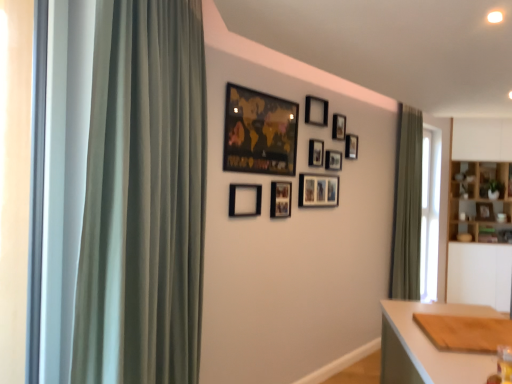
Question: Can you confirm if matte black picture frame at upper center, the second picture frame from the left, is positioned to the right of black matte picture frame at upper center, the 2th picture frame in the right-to-left sequence?

Choices:
 (A) no
 (B) yes

Answer: (A)

Question: Is black matte picture frame at upper center, which is counted as the second picture frame, starting from the back, a part of matte black picture frame at upper center, which is the first picture frame from front to back?

Choices:
 (A) no
 (B) yes

Answer: (A)

Question: From a real-world perspective, is matte black picture frame at upper center, which appears as the tenth picture frame when viewed from the back, physically below black matte picture frame at upper center, which is counted as the second picture frame, starting from the back?

Choices:
 (A) no
 (B) yes

Answer: (B)

Question: Is matte black picture frame at upper center, which is the first picture frame from front to back, closer to the viewer compared to black matte picture frame at upper center, arranged as the ninth picture frame when viewed from the front?

Choices:
 (A) yes
 (B) no

Answer: (A)

Question: Is matte black picture frame at upper center, placed as the 9th picture frame when sorted from right to left, with black matte picture frame at upper center, which is counted as the second picture frame, starting from the back?

Choices:
 (A) yes
 (B) no

Answer: (B)

Question: From the image's perspective, is black matte picture frame at upper center, positioned as the eighth picture frame in left-to-right order, above or below black matte picture frame at upper center, which ranks as the sixth picture frame in right-to-left order?

Choices:
 (A) above
 (B) below

Answer: (B)

Question: Is point (331, 137) closer or farther from the camera than point (310, 114)?

Choices:
 (A) closer
 (B) farther

Answer: (B)

Question: Is black matte picture frame at upper center, arranged as the 3th picture frame when viewed from the back, in front of or behind black matte picture frame at upper center, which ranks as the sixth picture frame in right-to-left order, in the image?

Choices:
 (A) behind
 (B) front

Answer: (A)

Question: Based on their sizes in the image, would you say black matte picture frame at upper center, placed as the 3th picture frame when sorted from right to left, is bigger or smaller than black matte picture frame at upper center, marked as the fifth picture frame in a front-to-back arrangement?

Choices:
 (A) small
 (B) big

Answer: (A)

Question: Is matte black picture frame at upper center, the second picture frame from the left, in front of or behind black matte picture frame at upper center, the 7th picture frame from the front, in the image?

Choices:
 (A) front
 (B) behind

Answer: (A)

Question: Is matte black picture frame at upper center, placed as the 9th picture frame when sorted from right to left, taller or shorter than black matte picture frame at upper center, the 7th picture frame from the front?

Choices:
 (A) short
 (B) tall

Answer: (B)

Question: From a real-world perspective, relative to black matte picture frame at upper center, the 7th picture frame from the front, is matte black picture frame at upper center, which is the first picture frame from front to back, vertically above or below?

Choices:
 (A) above
 (B) below

Answer: (A)

Question: Considering the positions of point (236, 129) and point (327, 162), is point (236, 129) closer or farther from the camera than point (327, 162)?

Choices:
 (A) closer
 (B) farther

Answer: (A)

Question: From their relative heights in the image, would you say wooden picture frame at center, which is the tenth picture frame in front-to-back order, is taller or shorter than green fabric curtain at left, marked as the first curtain in a left-to-right arrangement?

Choices:
 (A) tall
 (B) short

Answer: (B)

Question: Is point (493, 215) positioned closer to the camera than point (156, 276)?

Choices:
 (A) closer
 (B) farther

Answer: (B)